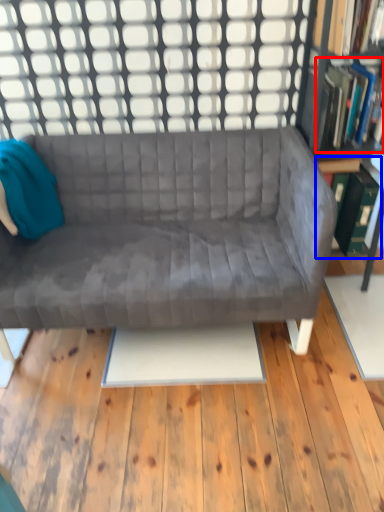
Question: Which object appears closest to the camera in this image, book (highlighted by a red box) or shelf (highlighted by a blue box)?

Choices:
 (A) book
 (B) shelf

Answer: (A)